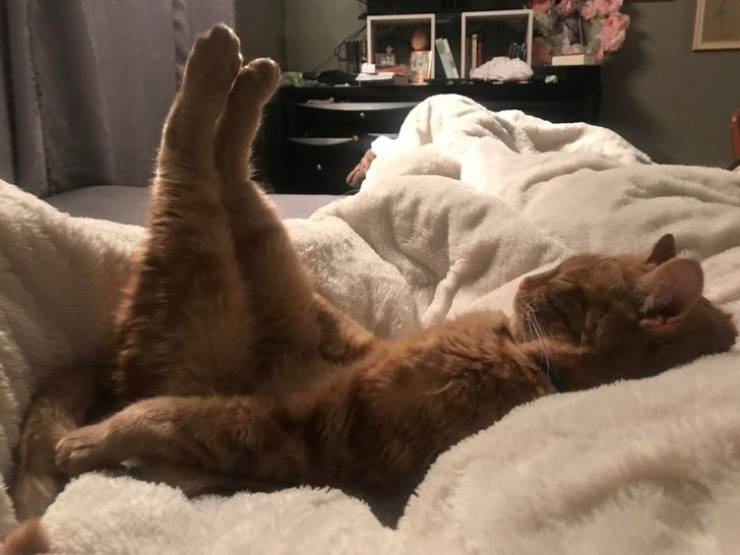
This screenshot has width=740, height=555. I want to click on white blanket, so click(541, 493).